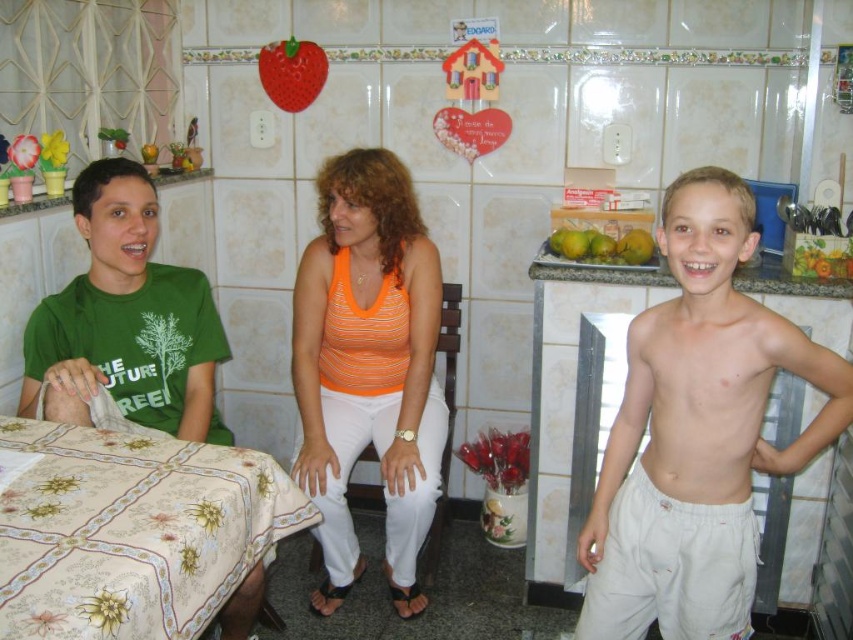
Question: Does orange striped tank top at center appear over green matte t-shirt at left?

Choices:
 (A) no
 (B) yes

Answer: (A)

Question: Considering the real-world distances, which object is farthest from the floral-patterned fabric at left?

Choices:
 (A) green matte t-shirt at left
 (B) rubber strawberry at upper center
 (C) green matte mangoes at upper right
 (D) light beige cotton shorts at right

Answer: (B)

Question: Where is floral-patterned fabric at left located in relation to rubber strawberry at upper center in the image?

Choices:
 (A) right
 (B) left

Answer: (A)

Question: Which object appears farthest from the camera in this image?

Choices:
 (A) floral-patterned fabric at left
 (B) green matte t-shirt at left
 (C) green matte mangoes at upper right

Answer: (C)

Question: Which object is closer to the camera taking this photo?

Choices:
 (A) light beige cotton shorts at right
 (B) green matte mangoes at upper right

Answer: (A)

Question: Is green matte t-shirt at left to the left of green matte mangoes at upper right from the viewer's perspective?

Choices:
 (A) no
 (B) yes

Answer: (B)